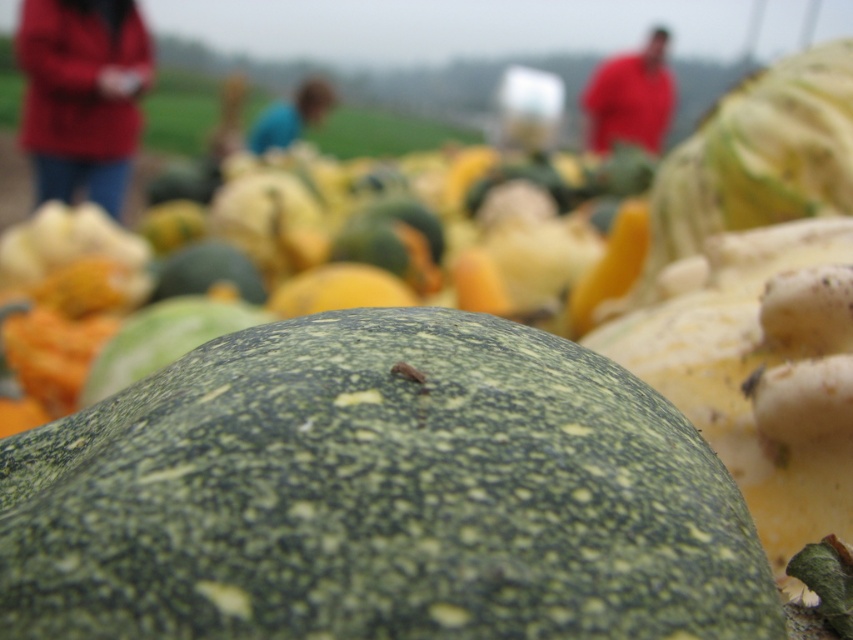
Can you confirm if matte red jacket at upper left is positioned above red cotton shirt at upper right?

Incorrect, matte red jacket at upper left is not positioned above red cotton shirt at upper right.

Does matte red jacket at upper left appear under red cotton shirt at upper right?

Yes, matte red jacket at upper left is below red cotton shirt at upper right.

Does point (39, 26) come farther from viewer compared to point (653, 48)?

No, (39, 26) is closer to viewer.

The image size is (853, 640). What are the coordinates of `matte red jacket at upper left` in the screenshot? It's located at (82, 93).

Is green rough gourd at center further to camera compared to blue fabric shirt at center?

No, green rough gourd at center is in front of blue fabric shirt at center.

Identify the location of green rough gourd at center. This screenshot has height=640, width=853. (378, 496).

Which of these two, green rough gourd at center or matte red jacket at upper left, stands taller?

matte red jacket at upper left

Can you confirm if green rough gourd at center is positioned above matte red jacket at upper left?

No, green rough gourd at center is not above matte red jacket at upper left.

Which is in front, point (614, 500) or point (120, 67)?

Positioned in front is point (614, 500).

Find the location of a particular element. The width and height of the screenshot is (853, 640). green rough gourd at center is located at coordinates (378, 496).